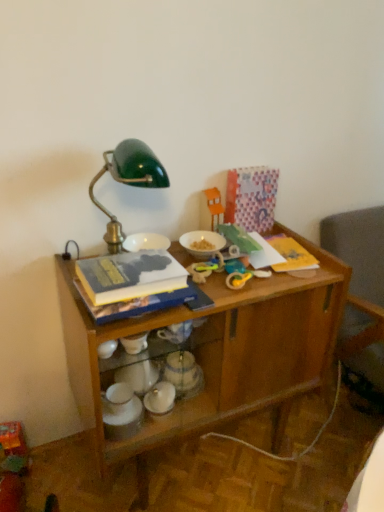
You are a GUI agent. You are given a task and a screenshot of the screen. Output one action in this format:
    pyautogui.click(x=<x>, y=<y>)
    Task: Click on the vacant space in front of rubber yellow toy at center, acting as the second toy starting from the back
    Image resolution: width=384 pixels, height=512 pixels.
    Given the screenshot: What is the action you would take?
    pyautogui.click(x=213, y=295)